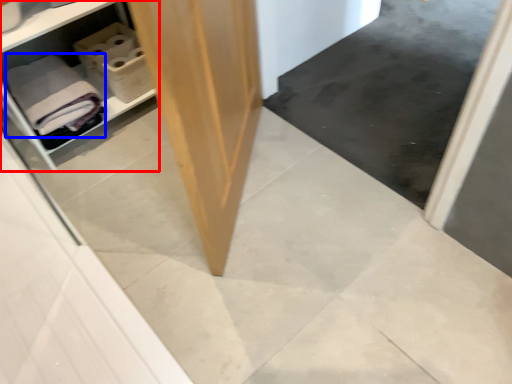
Question: Which object is further to the camera taking this photo, shelf (highlighted by a red box) or bath towel (highlighted by a blue box)?

Choices:
 (A) shelf
 (B) bath towel

Answer: (B)